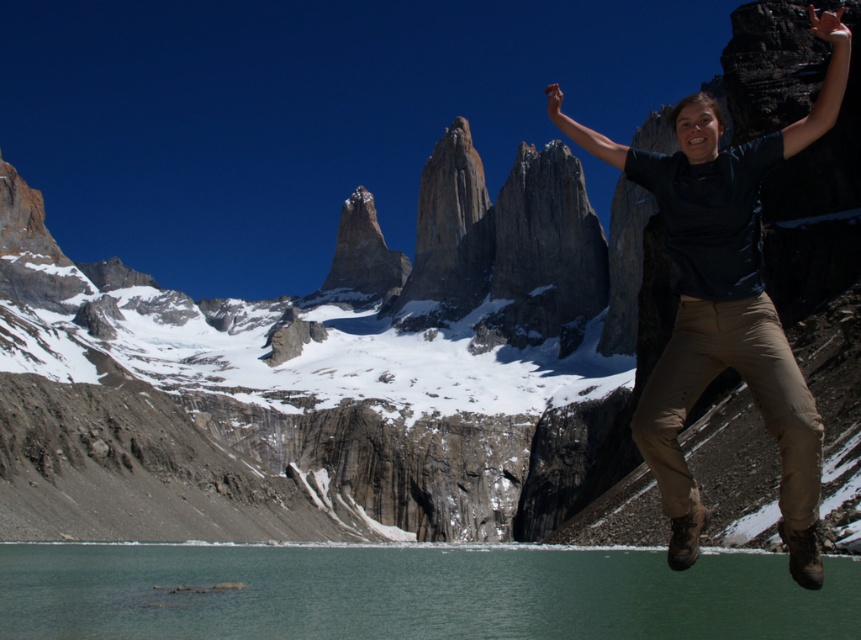
You are a photographer positioned at the camera. You want to capture a photo of the point at coordinates (x=162, y=547). The camera has a focal length of 50mm. What is the approximate distance in feet between the camera and the point?

The point at coordinates (x=162, y=547) is 319.51 feet away from the camera, so the distance is approximately 319.51 feet.